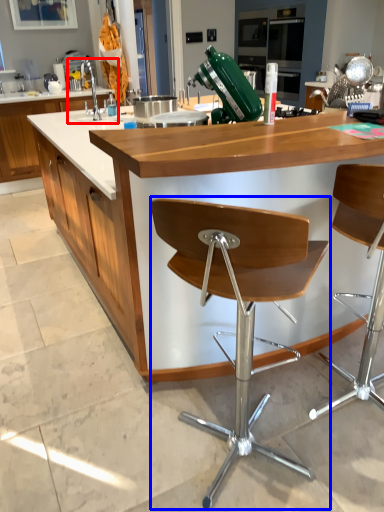
Question: Which object appears closest to the camera in this image, sink (highlighted by a red box) or chair (highlighted by a blue box)?

Choices:
 (A) sink
 (B) chair

Answer: (B)